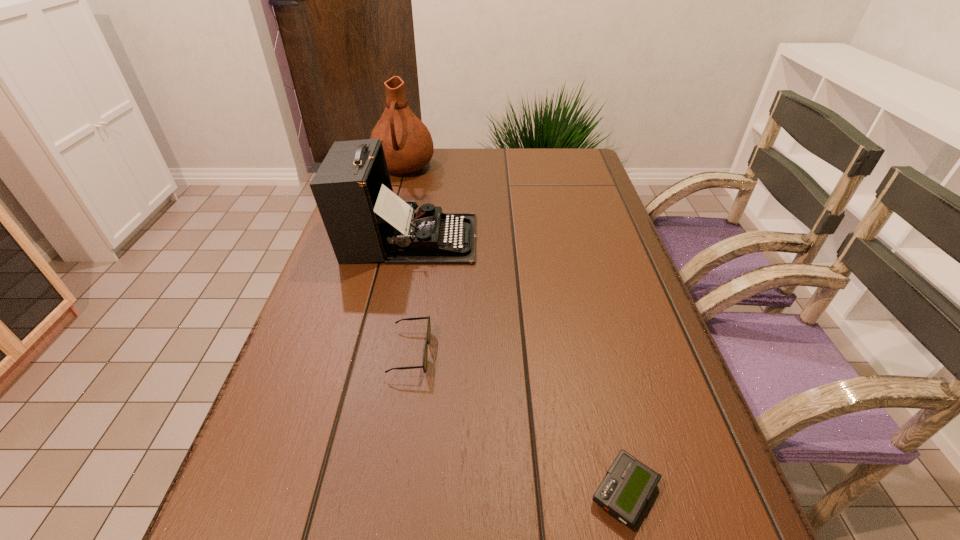
What are the coordinates of `pitcher` in the screenshot? It's located at (407, 143).

Image resolution: width=960 pixels, height=540 pixels. Find the location of `typewriter`. typewriter is located at coordinates (365, 221).

At what (x,y) coordinates should I click in order to perform the action: click on sunglasses. Please return your answer as a coordinate pair (x, y). The height and width of the screenshot is (540, 960). Looking at the image, I should click on (425, 357).

Where is `the third farthest object`? Image resolution: width=960 pixels, height=540 pixels. the third farthest object is located at coordinates (425, 357).

This screenshot has width=960, height=540. Identify the location of the nearest object. (628, 485).

This screenshot has width=960, height=540. In order to click on the rightmost object in this screenshot , I will do `click(628, 485)`.

In order to click on blank space located 0.370m on the side of the farthest object with the handle in this screenshot , I will do `click(378, 259)`.

The width and height of the screenshot is (960, 540). In order to click on vacant space situated inside the open case of the typewriter in this screenshot , I will do `click(531, 239)`.

Image resolution: width=960 pixels, height=540 pixels. Find the location of `free space located 0.150m on the front-facing side of the sunglasses`. free space located 0.150m on the front-facing side of the sunglasses is located at coordinates (505, 353).

Locate an element on the screen. vacant space located 0.120m on the back of the shortest object is located at coordinates (601, 393).